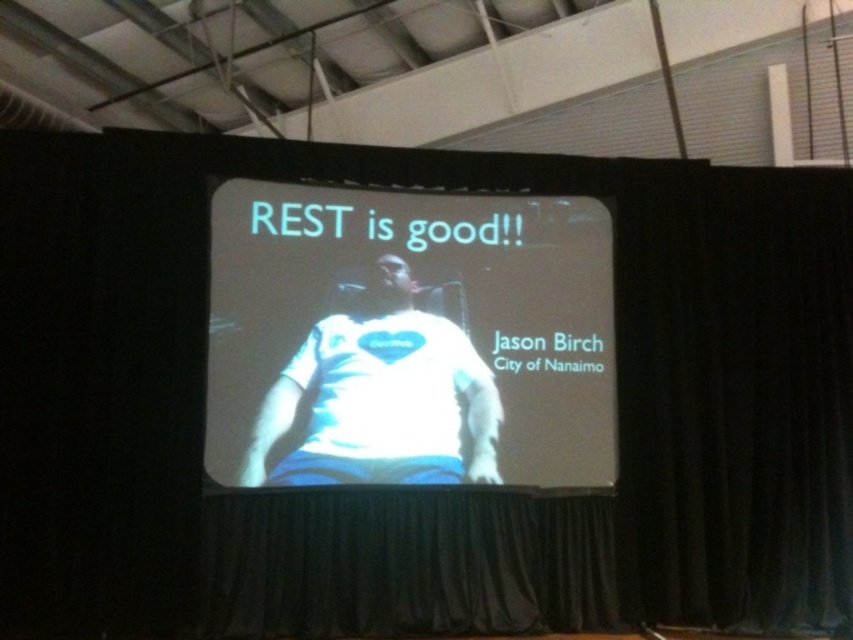
You are standing in front of the presentation screen and see two points marked on the slide. Which point is closer to you, point (x=426, y=404) or point (x=466, y=396)?

Point (x=426, y=404) is in front of point (x=466, y=396), so it is closer to you.

You are an event organizer who needs to ensure that the white glossy projector screen at center and the white fabric shirt at center are visible to the audience. Considering their sizes, which object is more likely to be easily seen from the back of the room?

The white glossy projector screen at center is much taller than the white fabric shirt at center, so it is more likely to be easily seen from the back of the room.